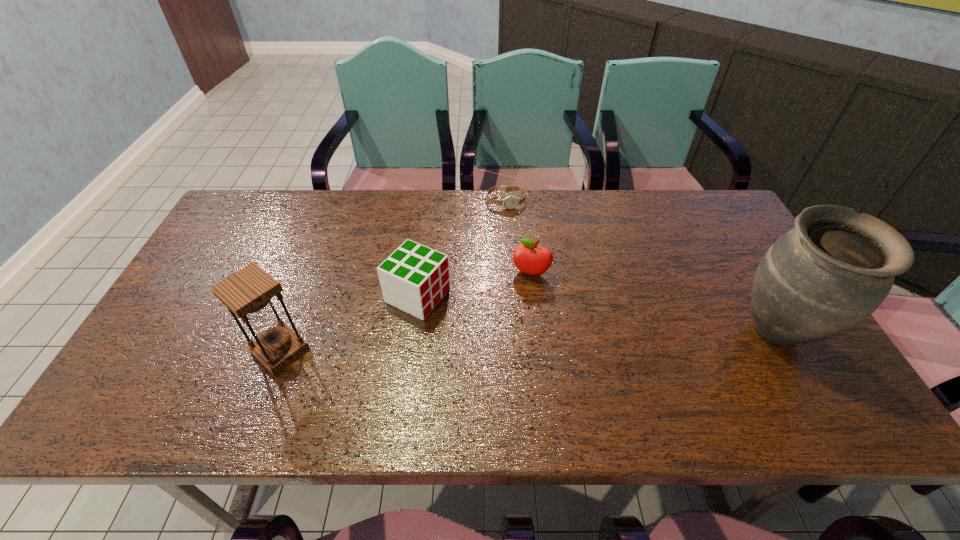
Where is `free space on the desktop that is between the leftmost object and the rightmost object and is positioned on the face of the watch`? free space on the desktop that is between the leftmost object and the rightmost object and is positioned on the face of the watch is located at coordinates (534, 341).

This screenshot has width=960, height=540. I want to click on free space on the desktop that is between the hourglass and the tallest object and is positioned on the front-facing side of the apple, so [505, 342].

Where is `vacant space on the desktop that is between the leftmost object and the urn and is positioned on the red face of the fourth object from right to left`? vacant space on the desktop that is between the leftmost object and the urn and is positioned on the red face of the fourth object from right to left is located at coordinates (517, 342).